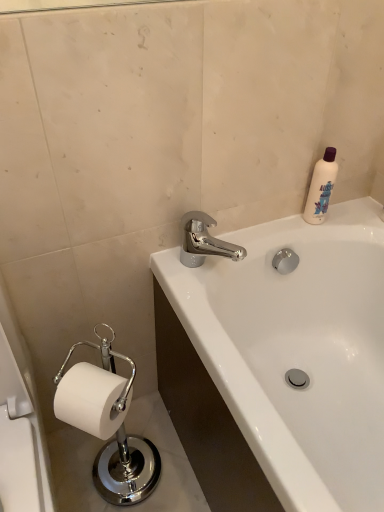
Identify the location of vacant position to the left of white plastic bottle at upper right. (278, 229).